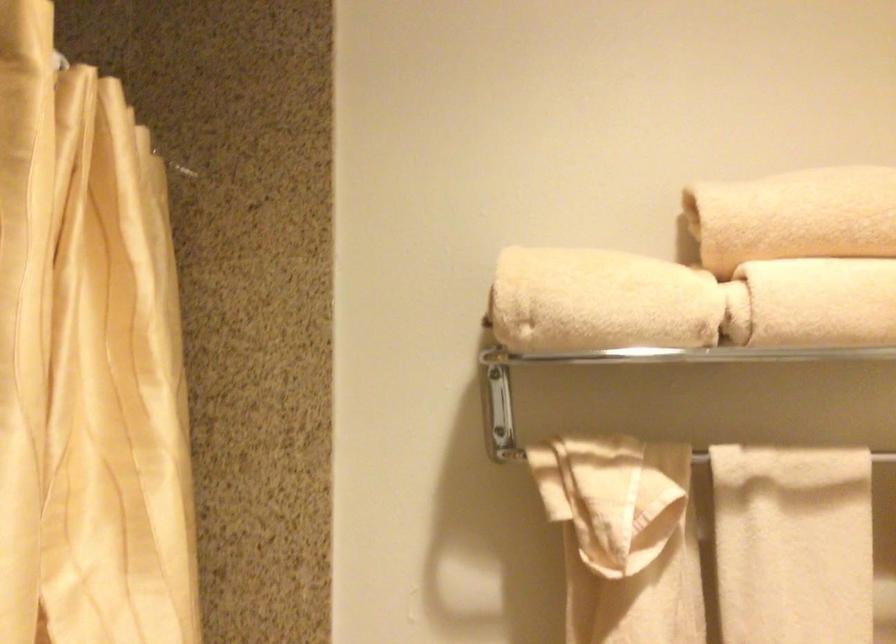
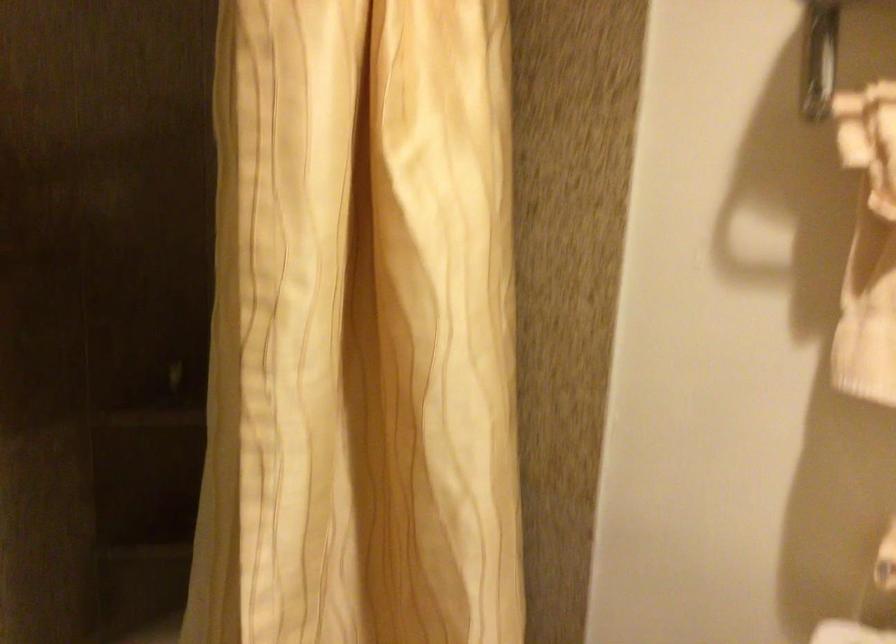
First-person continuous shooting, in which direction is the camera rotating?

The rotation direction of the camera is left-down.